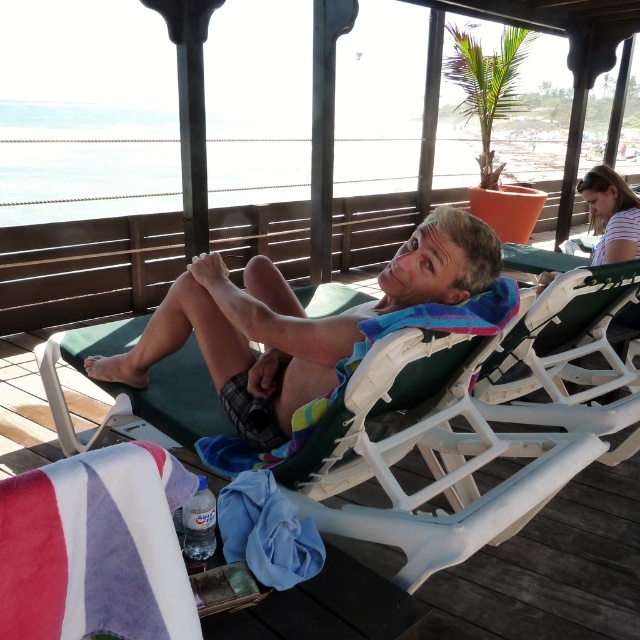
Does plaid shorts at center have a greater width compared to velvet-like beach towel at lower left?

Yes.

What do you see at coordinates (296, 323) in the screenshot? The width and height of the screenshot is (640, 640). I see `plaid shorts at center` at bounding box center [296, 323].

Where is `plaid shorts at center`? This screenshot has width=640, height=640. plaid shorts at center is located at coordinates (296, 323).

Is green plastic chair at center shorter than plaid shorts at center?

No.

Does green plastic chair at center have a greater height compared to plaid shorts at center?

Yes, green plastic chair at center is taller than plaid shorts at center.

You are a GUI agent. You are given a task and a screenshot of the screen. Output one action in this format:
    pyautogui.click(x=<x>, y=<y>)
    Task: Click on the green plastic chair at center
    
    Given the screenshot: What is the action you would take?
    pyautogui.click(x=442, y=440)

Can you confirm if green plastic chair at center is bigger than blue fabric towel at lower center?

Yes, green plastic chair at center is bigger than blue fabric towel at lower center.

Is green plastic chair at center to the right of blue fabric towel at lower center from the viewer's perspective?

Correct, you'll find green plastic chair at center to the right of blue fabric towel at lower center.

Which is behind, point (566, 433) or point (284, 532)?

The point (566, 433) is behind.

The width and height of the screenshot is (640, 640). I want to click on green plastic chair at center, so click(442, 440).